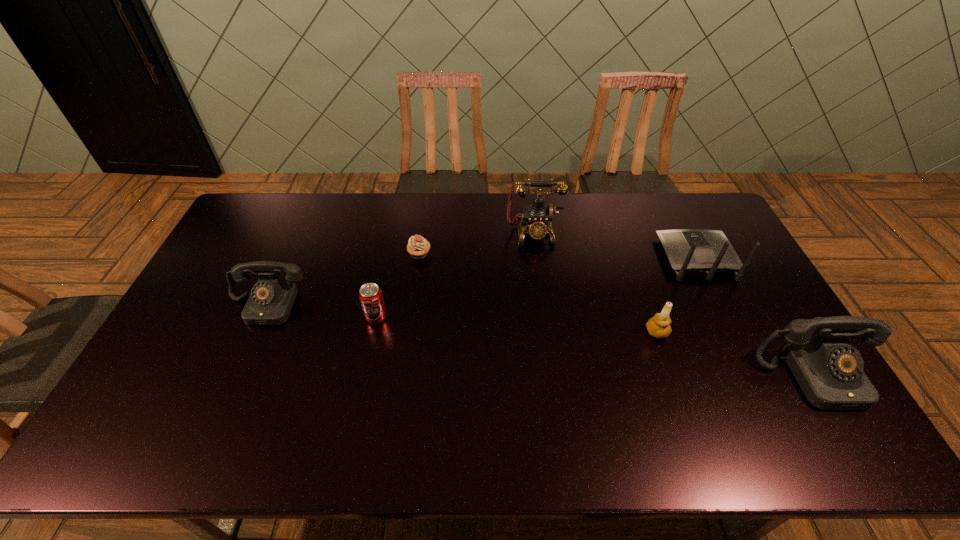
In the image, there is a desktop. Where is `vacant space at the far right corner`? Image resolution: width=960 pixels, height=540 pixels. vacant space at the far right corner is located at coordinates (690, 206).

Where is `free space between the second nearest telephone and the third object from left to right`? free space between the second nearest telephone and the third object from left to right is located at coordinates (343, 280).

Locate an element on the screen. This screenshot has width=960, height=540. vacant space that's between the third object from right to left and the cupcake is located at coordinates (538, 293).

Find the location of `vacant area that lies between the sixth object from right to left and the second telephone from left to right`. vacant area that lies between the sixth object from right to left and the second telephone from left to right is located at coordinates (455, 275).

At what (x,y) coordinates should I click in order to perform the action: click on free space between the leftmost object and the tallest telephone. Please return your answer as a coordinate pair (x, y). The height and width of the screenshot is (540, 960). Looking at the image, I should click on (399, 269).

Where is `empty space between the fifth object from right to left and the candle_holder`? The width and height of the screenshot is (960, 540). empty space between the fifth object from right to left and the candle_holder is located at coordinates (538, 293).

The image size is (960, 540). I want to click on blank region between the second object from left to right and the cupcake, so click(397, 286).

Image resolution: width=960 pixels, height=540 pixels. In order to click on vacant area that lies between the soda and the router in this screenshot , I will do `click(537, 288)`.

Locate an element on the screen. The width and height of the screenshot is (960, 540). free point between the tallest telephone and the rightmost telephone is located at coordinates (674, 305).

At what (x,y) coordinates should I click in order to perform the action: click on vacant area that lies between the fifth object from right to left and the soda. Please return your answer as a coordinate pair (x, y). Looking at the image, I should click on (397, 286).